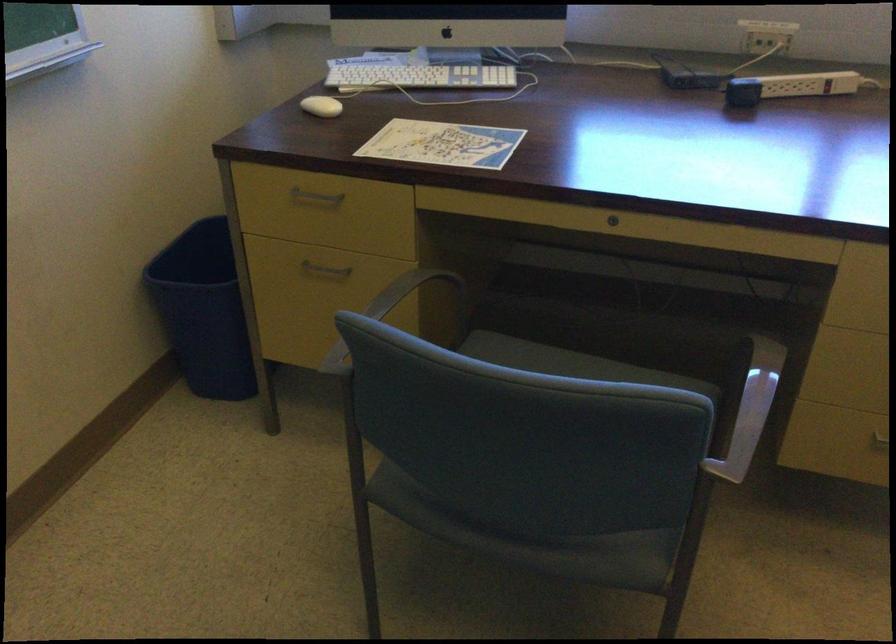
The height and width of the screenshot is (644, 896). Identify the location of white computer mouse. [321, 106].